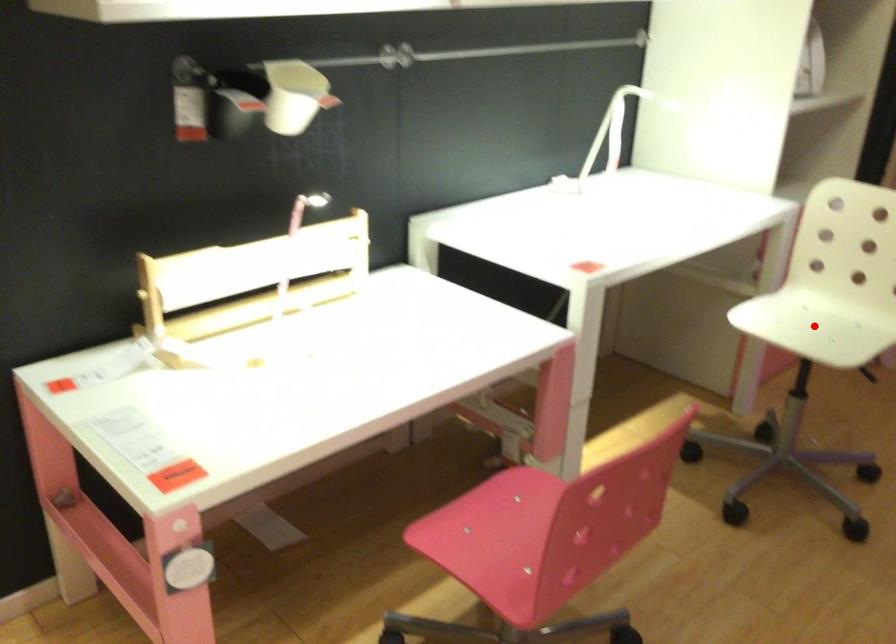
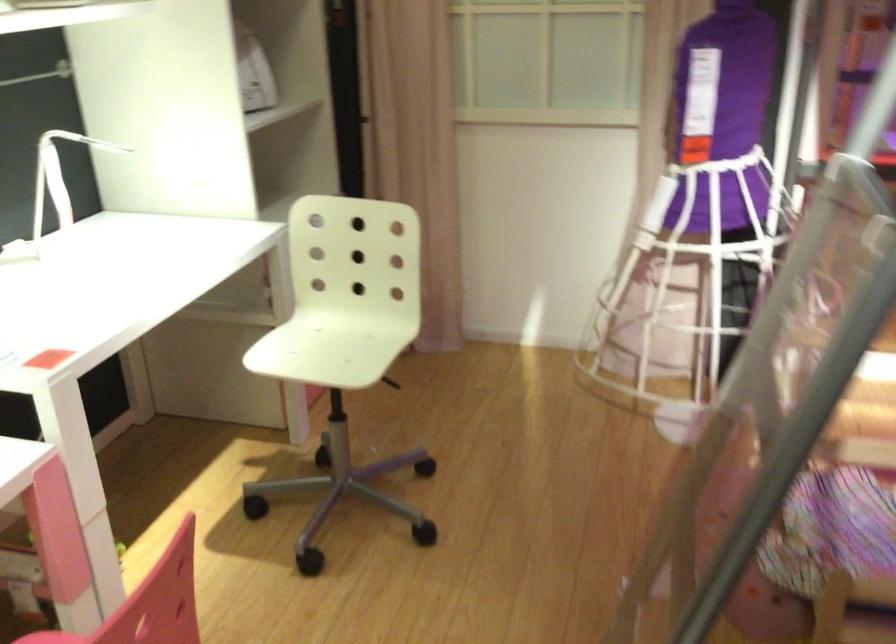
Find the pixel in the second image that matches the highlighted location in the first image.

(331, 345)